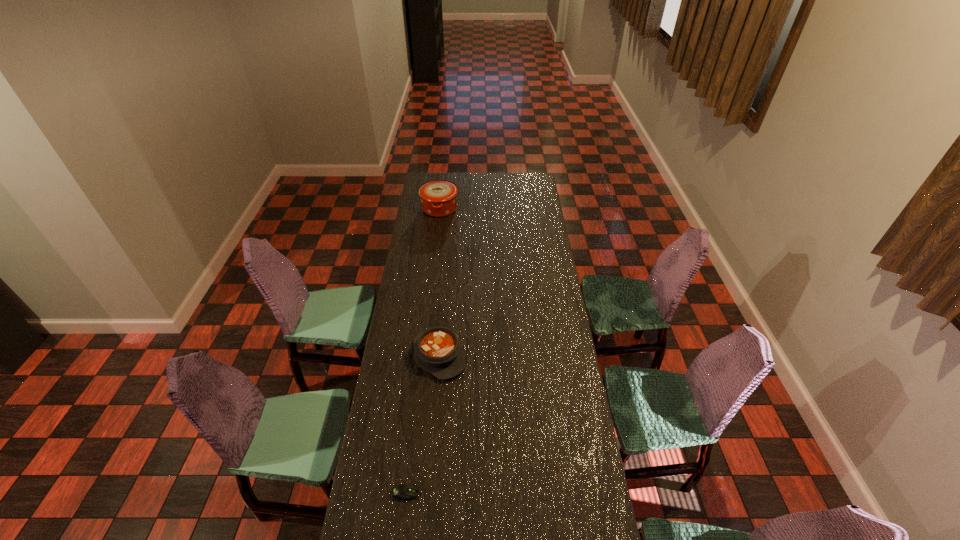
This screenshot has width=960, height=540. I want to click on the farthest object, so click(438, 197).

Locate an element on the screen. The width and height of the screenshot is (960, 540). the taller casserole is located at coordinates (438, 197).

I want to click on the shorter casserole, so click(438, 350).

In order to click on the second shortest object in this screenshot , I will do (x=438, y=350).

This screenshot has width=960, height=540. I want to click on the shortest object, so click(401, 492).

This screenshot has height=540, width=960. I want to click on the nearest object, so click(401, 492).

What are the coordinates of `vacant space located on the front of the farther casserole` in the screenshot? It's located at (435, 252).

Locate an element on the screen. The image size is (960, 540). vacant space located on the front of the shorter casserole is located at coordinates click(435, 408).

Find the location of `vacant region located on the wheel side of the nearest object`. vacant region located on the wheel side of the nearest object is located at coordinates (438, 492).

You are a GUI agent. You are given a task and a screenshot of the screen. Output one action in this format:
    pyautogui.click(x=<x>, y=<y>)
    Task: Click on the computer mouse at the left edge
    
    Given the screenshot: What is the action you would take?
    pyautogui.click(x=401, y=492)